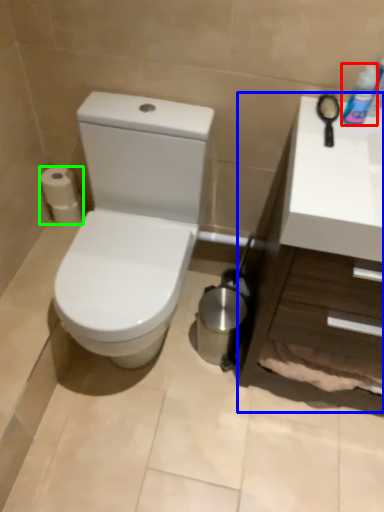
Question: Which is farther away from mouthwash (highlighted by a red box)? counter top (highlighted by a blue box) or toilet paper (highlighted by a green box)?

Choices:
 (A) counter top
 (B) toilet paper

Answer: (B)